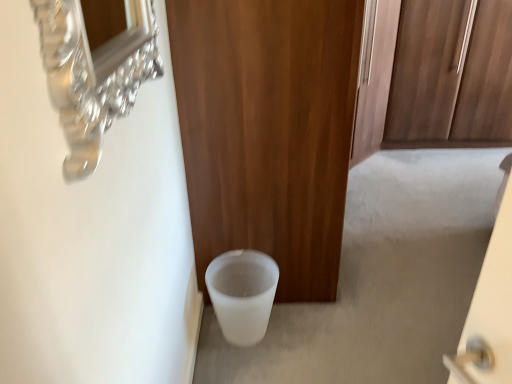
Question: From a real-world perspective, is white matte trash can at lower center positioned over white frosted glass toilet bowl at lower left based on gravity?

Choices:
 (A) yes
 (B) no

Answer: (B)

Question: Considering the relative sizes of white matte trash can at lower center and white frosted glass toilet bowl at lower left in the image provided, is white matte trash can at lower center taller than white frosted glass toilet bowl at lower left?

Choices:
 (A) no
 (B) yes

Answer: (A)

Question: Can you confirm if white matte trash can at lower center is positioned to the left of white frosted glass toilet bowl at lower left?

Choices:
 (A) yes
 (B) no

Answer: (B)

Question: Considering the relative sizes of white matte trash can at lower center and white frosted glass toilet bowl at lower left in the image provided, is white matte trash can at lower center wider than white frosted glass toilet bowl at lower left?

Choices:
 (A) yes
 (B) no

Answer: (A)

Question: Is white matte trash can at lower center outside of white frosted glass toilet bowl at lower left?

Choices:
 (A) yes
 (B) no

Answer: (A)

Question: Does white matte trash can at lower center have a lesser height compared to white frosted glass toilet bowl at lower left?

Choices:
 (A) yes
 (B) no

Answer: (A)

Question: Can you confirm if white matte trash can at lower center is positioned to the right of wooden door at center?

Choices:
 (A) yes
 (B) no

Answer: (A)

Question: From the image's perspective, would you say white matte trash can at lower center is positioned over wooden door at center?

Choices:
 (A) yes
 (B) no

Answer: (B)

Question: Is white matte trash can at lower center bigger than wooden door at center?

Choices:
 (A) no
 (B) yes

Answer: (A)

Question: Would you say white matte trash can at lower center contains wooden door at center?

Choices:
 (A) yes
 (B) no

Answer: (B)

Question: Considering the relative positions of white matte trash can at lower center and wooden door at center in the image provided, is white matte trash can at lower center in front of wooden door at center?

Choices:
 (A) no
 (B) yes

Answer: (A)

Question: Does white matte trash can at lower center have a lesser width compared to wooden door at center?

Choices:
 (A) yes
 (B) no

Answer: (B)

Question: Can you confirm if wooden door at center is taller than white frosted glass toilet bowl at lower left?

Choices:
 (A) yes
 (B) no

Answer: (A)